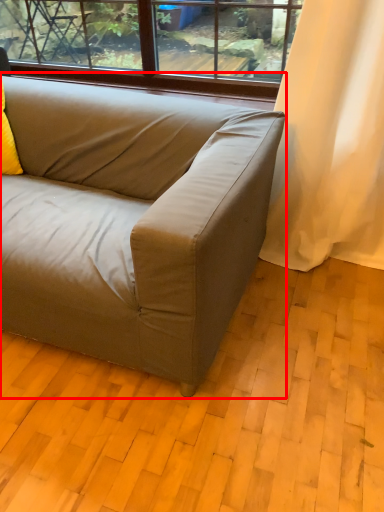
Question: From the image's perspective, where is studio couch (annotated by the red box) located relative to pillow?

Choices:
 (A) above
 (B) below

Answer: (B)